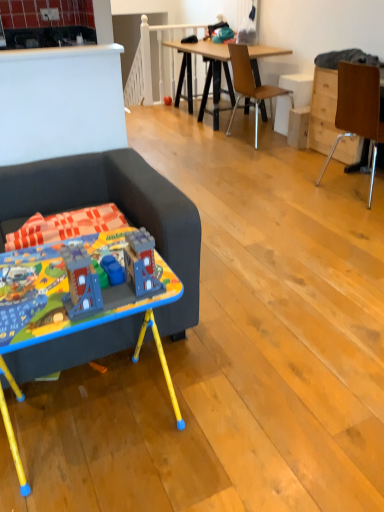
Where is `free space between blue plastic desk at lower left and dark gray fabric couch at left`? Image resolution: width=384 pixels, height=512 pixels. free space between blue plastic desk at lower left and dark gray fabric couch at left is located at coordinates (182, 371).